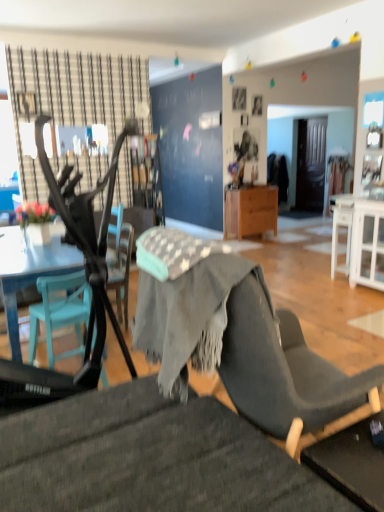
Question: In terms of height, does wooden cabinet at center look taller or shorter compared to textured gray chair at lower center, arranged as the second chair when viewed from the back?

Choices:
 (A) short
 (B) tall

Answer: (A)

Question: From the image's perspective, is wooden cabinet at center located above or below textured gray chair at lower center, arranged as the second chair when viewed from the back?

Choices:
 (A) below
 (B) above

Answer: (B)

Question: Which is nearer to the metallic black feeding chair at left?

Choices:
 (A) textured gray chair at lower center, which ranks as the 1th chair in front-to-back order
 (B) wooden picture frame at upper center, the 1th picture frame when ordered from left to right
 (C) wooden cabinet at center
 (D) white glossy cabinet at right
 (E) teal plastic chair at left, the first chair viewed from the back

Answer: (E)

Question: Estimate the real-world distances between objects in this image. Which object is farther from the metallic black feeding chair at left?

Choices:
 (A) wooden cabinet at center
 (B) white glossy cabinet at right
 (C) wooden picture frame at upper center, which appears as the second picture frame when viewed from the left
 (D) wooden picture frame at upper center, marked as the 2th picture frame in a back-to-front arrangement
 (E) teal plastic chair at left, which appears as the 2th chair when viewed from the front

Answer: (C)